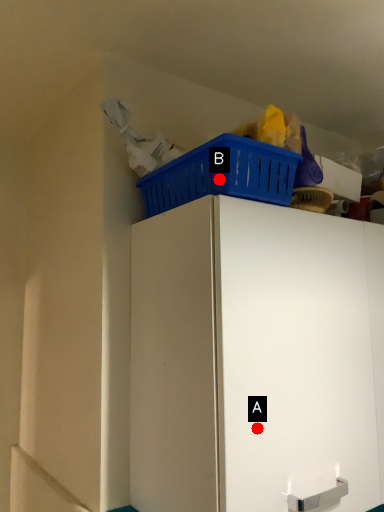
Question: Two points are circled on the image, labeled by A and B beside each circle. Among these points, which one is nearest to the camera?

Choices:
 (A) A is closer
 (B) B is closer

Answer: (A)